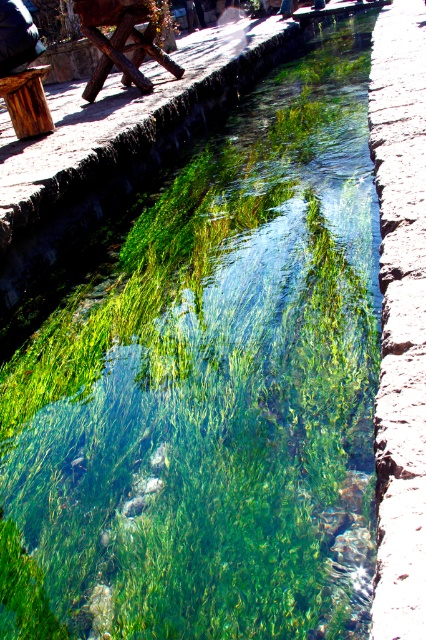
You are planning to set up a picnic at the rustic outdoor setting shown. You have a wooden picnic table at upper left and a wooden stool at upper left. Which object should you move if you want to place a large basket between them?

You should move the wooden stool at upper left to the left since the wooden picnic table at upper left is already to the right of it, creating space between them for the basket.

You are planning to set up a small outdoor event and need to place a tall flower vase on either the wooden picnic table at upper left or the wooden stool at upper left. Which surface can safely support the vase without it being too unstable?

The wooden picnic table at upper left has a greater height compared to the wooden stool at upper left, so placing the tall flower vase on the wooden picnic table at upper left would provide a more stable base due to its higher surface, reducing the risk of tipping over.